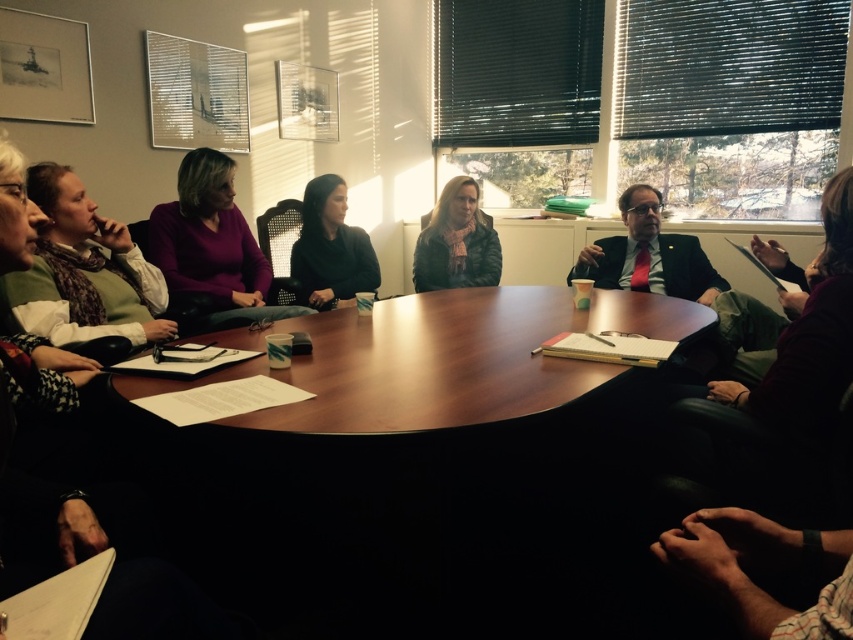
Question: Where is black matte sweater at center located in relation to matte black jacket at center in the image?

Choices:
 (A) above
 (B) below

Answer: (B)

Question: Considering the relative positions of green sweater at left and black matte sweater at center in the image provided, where is green sweater at left located with respect to black matte sweater at center?

Choices:
 (A) left
 (B) right

Answer: (A)

Question: Which point is farther from the camera taking this photo?

Choices:
 (A) (67, 202)
 (B) (169, 280)
 (C) (314, 289)

Answer: (C)

Question: Can you confirm if matte purple sweater at center is positioned to the left of black matte sweater at center?

Choices:
 (A) yes
 (B) no

Answer: (A)

Question: Which object is farther from the camera taking this photo?

Choices:
 (A) black matte sweater at center
 (B) green sweater at left
 (C) matte black jacket at center

Answer: (C)

Question: Which point appears closest to the camera in this image?

Choices:
 (A) (70, 260)
 (B) (315, 273)
 (C) (196, 320)
 (D) (457, 200)

Answer: (A)